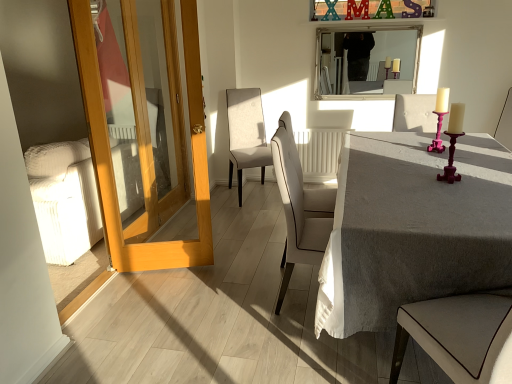
Question: Does white leather chair at center, the second chair in the right-to-left sequence, have a larger size compared to silver/metallic mirror at upper center?

Choices:
 (A) yes
 (B) no

Answer: (A)

Question: Considering the relative sizes of white leather chair at center, the second chair in the right-to-left sequence, and silver/metallic mirror at upper center in the image provided, is white leather chair at center, the second chair in the right-to-left sequence, thinner than silver/metallic mirror at upper center?

Choices:
 (A) no
 (B) yes

Answer: (A)

Question: Does white leather chair at center, the second chair in the right-to-left sequence, have a lesser height compared to silver/metallic mirror at upper center?

Choices:
 (A) no
 (B) yes

Answer: (A)

Question: Is the depth of white leather chair at center, arranged as the first chair when viewed from the front, less than that of silver/metallic mirror at upper center?

Choices:
 (A) no
 (B) yes

Answer: (B)

Question: Is white leather chair at center, which ranks as the 3th chair in back-to-front order, not near silver/metallic mirror at upper center?

Choices:
 (A) no
 (B) yes

Answer: (B)

Question: Can we say white leather chair at center, arranged as the first chair when viewed from the front, lies outside silver/metallic mirror at upper center?

Choices:
 (A) no
 (B) yes

Answer: (B)

Question: Is gray linen table at center not near white leather chair at center, arranged as the first chair when viewed from the front?

Choices:
 (A) yes
 (B) no

Answer: (B)

Question: Is the position of gray linen table at center less distant than that of white leather chair at center, which ranks as the 2th chair in left-to-right order?

Choices:
 (A) no
 (B) yes

Answer: (B)

Question: From the image's perspective, would you say gray linen table at center is shown under white leather chair at center, which ranks as the 2th chair in left-to-right order?

Choices:
 (A) no
 (B) yes

Answer: (B)

Question: From a real-world perspective, is gray linen table at center positioned under white leather chair at center, arranged as the first chair when viewed from the front, based on gravity?

Choices:
 (A) yes
 (B) no

Answer: (A)

Question: Is white leather chair at center, the second chair in the right-to-left sequence, at the back of gray linen table at center?

Choices:
 (A) no
 (B) yes

Answer: (A)

Question: Does gray linen table at center have a greater width compared to white leather chair at center, arranged as the first chair when viewed from the front?

Choices:
 (A) yes
 (B) no

Answer: (A)

Question: From the image's perspective, is gray linen table at center located above light wood door at left?

Choices:
 (A) no
 (B) yes

Answer: (A)